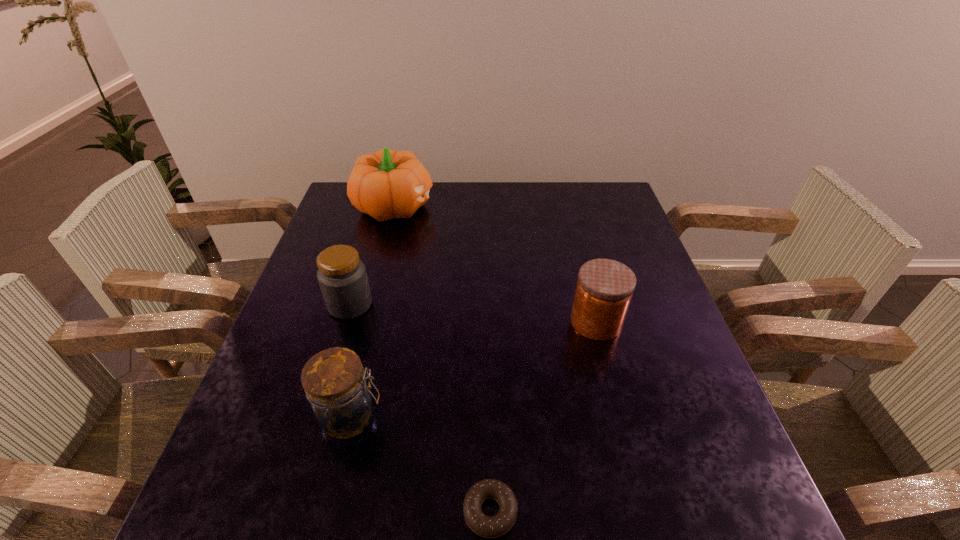
Locate an element on the screen. the tallest object is located at coordinates click(387, 184).

At what (x,y) coordinates should I click in order to perform the action: click on pumpkin. Please return your answer as a coordinate pair (x, y). The image size is (960, 540). Looking at the image, I should click on (387, 184).

Find the location of a particular element. This screenshot has height=540, width=960. the nearest jar is located at coordinates (335, 383).

Locate an element on the screen. Image resolution: width=960 pixels, height=540 pixels. the rightmost jar is located at coordinates (605, 287).

Identify the location of vacant space located 0.180m on the carved face of the farthest object. (491, 206).

In order to click on vacant space positioned on the lid of the fourth farthest object in this screenshot , I will do `click(527, 416)`.

I want to click on blank space located 0.390m on the left of the rightmost object, so click(x=405, y=322).

Where is `object positioned at the far edge`? The height and width of the screenshot is (540, 960). object positioned at the far edge is located at coordinates (387, 184).

You are a GUI agent. You are given a task and a screenshot of the screen. Output one action in this format:
    pyautogui.click(x=<x>, y=<y>)
    Task: Click on the pumpkin at the left edge
    The width and height of the screenshot is (960, 540).
    Given the screenshot: What is the action you would take?
    pyautogui.click(x=387, y=184)

You are a GUI agent. You are given a task and a screenshot of the screen. Output one action in this format:
    pyautogui.click(x=<x>, y=<y>)
    Task: Click on the object present at the right edge
    
    Given the screenshot: What is the action you would take?
    pyautogui.click(x=605, y=287)